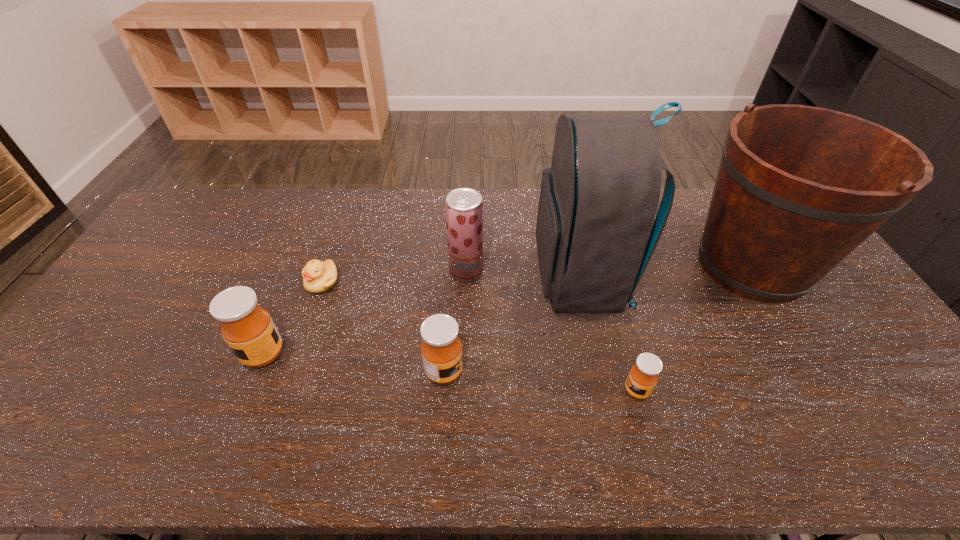
Where is `vacant space located on the front-facing side of the tallest object`? vacant space located on the front-facing side of the tallest object is located at coordinates (479, 280).

The height and width of the screenshot is (540, 960). I want to click on free space located 0.300m on the front-facing side of the tallest object, so click(436, 280).

Identify the location of free space located 0.060m on the left of the fifth shortest object. The image size is (960, 540). (430, 272).

The width and height of the screenshot is (960, 540). What are the coordinates of `object present at the far edge` in the screenshot? It's located at (799, 187).

Image resolution: width=960 pixels, height=540 pixels. What are the coordinates of `object present at the right edge` in the screenshot? It's located at (799, 187).

I want to click on object present at the far right corner, so click(799, 187).

You are a GUI agent. You are given a task and a screenshot of the screen. Output one action in this format:
    pyautogui.click(x=<x>, y=<y>)
    Task: Click on the vacant space at the far edge of the desktop
    
    Given the screenshot: What is the action you would take?
    pyautogui.click(x=444, y=206)

Locate an element on the screen. free space at the near edge of the desktop is located at coordinates (738, 404).

Where is `vacant space at the left edge of the desktop`? The width and height of the screenshot is (960, 540). vacant space at the left edge of the desktop is located at coordinates [x=135, y=331].

In the image, there is a desktop. At what (x,y) coordinates should I click in order to perform the action: click on blank space at the right edge. Please return your answer as a coordinate pair (x, y). This screenshot has width=960, height=540. Looking at the image, I should click on (837, 284).